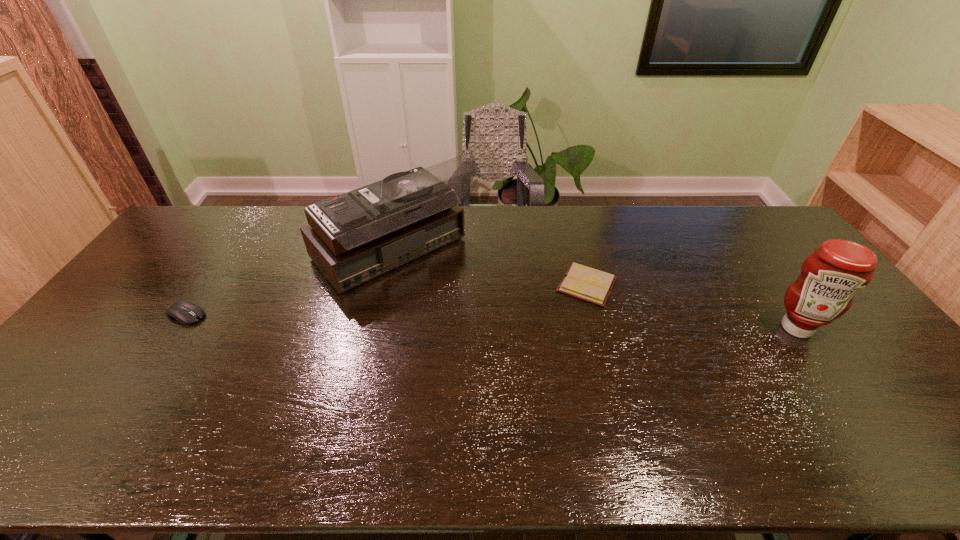
You are a GUI agent. You are given a task and a screenshot of the screen. Output one action in this format:
    pyautogui.click(x=<x>, y=<y>)
    Task: Click on the record player
    
    Given the screenshot: What is the action you would take?
    pyautogui.click(x=354, y=237)

Where is `the tallest object`? the tallest object is located at coordinates (354, 237).

You are a GUI agent. You are given a task and a screenshot of the screen. Output one action in this format:
    pyautogui.click(x=<x>, y=<y>)
    Task: Click on the condiment
    The height and width of the screenshot is (540, 960).
    Given the screenshot: What is the action you would take?
    pyautogui.click(x=830, y=277)

At what (x,y) coordinates should I click in order to perform the action: click on the rightmost object. Please return your answer as a coordinate pair (x, y). The width and height of the screenshot is (960, 540). Looking at the image, I should click on (830, 277).

This screenshot has height=540, width=960. I want to click on computer equipment, so (184, 312).

You are a GUI agent. You are given a task and a screenshot of the screen. Output one action in this format:
    pyautogui.click(x=<x>, y=<y>)
    Task: Click on the leftmost object
    The height and width of the screenshot is (540, 960).
    Given the screenshot: What is the action you would take?
    pyautogui.click(x=184, y=312)

You are a GUI agent. You are given a task and a screenshot of the screen. Output one action in this format:
    pyautogui.click(x=<x>, y=<y>)
    Task: Click on the diary
    
    Given the screenshot: What is the action you would take?
    pyautogui.click(x=582, y=282)

Identify the location of the shortest object. (582, 282).

In order to click on free space located on the left of the third object from right to left in this screenshot , I will do `click(206, 254)`.

The image size is (960, 540). In order to click on vacant point located on the back of the third shortest object in this screenshot , I will do `click(772, 293)`.